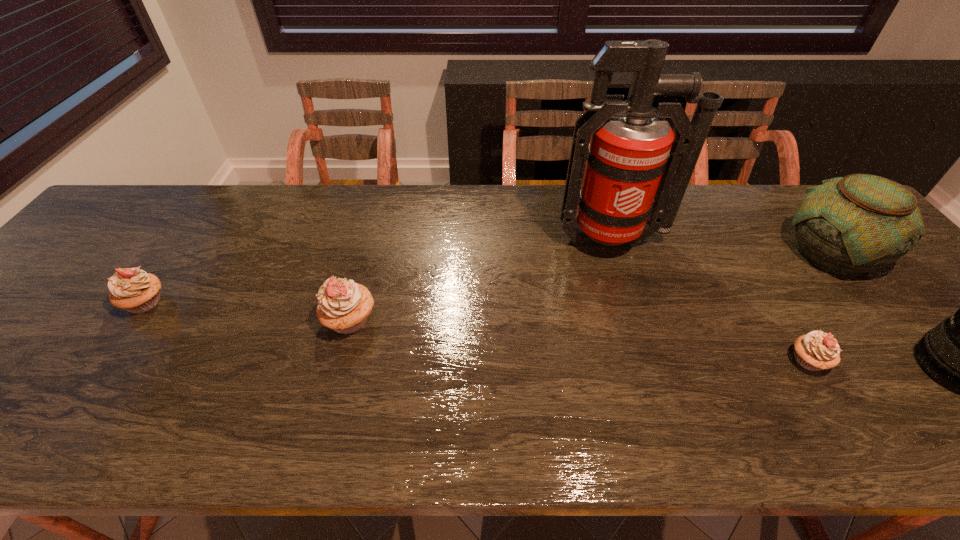
The image size is (960, 540). I want to click on object that is the third closest to the shortest cupcake, so click(x=637, y=170).

Select which object is the closest to the fifth object from right to left. Please provide its 2D coordinates. Your answer should be formatted as a tuple, i.e. [(x, y)], where the tuple contains the x and y coordinates of a point satisfying the conditions above.

[(132, 289)]

This screenshot has height=540, width=960. What are the coordinates of `cupcake that stands as the third closest to the tallest object` in the screenshot? It's located at (132, 289).

Find the location of `cupcake that stands as the third closest to the pottery`. cupcake that stands as the third closest to the pottery is located at coordinates (132, 289).

This screenshot has height=540, width=960. What are the coordinates of `free location that satisfies the following two spatial constraints: 1. on the back side of the fifth object from right to left; 2. on the right side of the pottery` in the screenshot? It's located at (368, 253).

The width and height of the screenshot is (960, 540). What are the coordinates of `free location that satisfies the following two spatial constraints: 1. on the back side of the fifth tallest object; 2. on the left side of the pottery` in the screenshot? It's located at (180, 253).